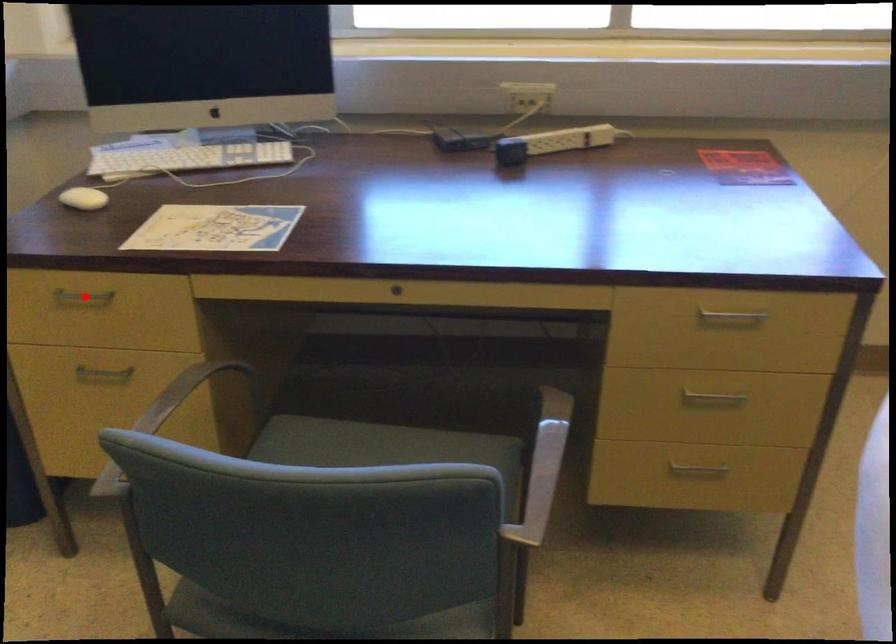
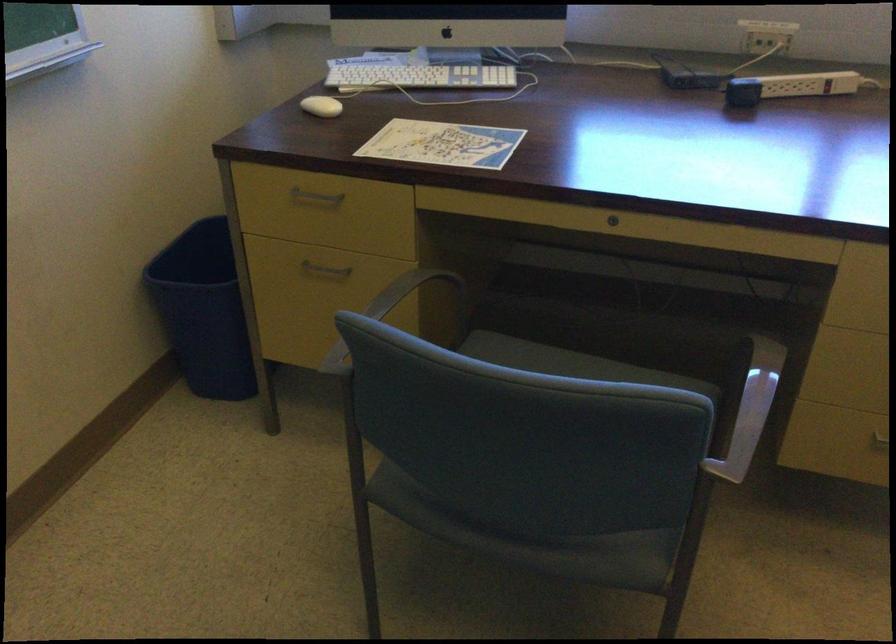
Locate, in the second image, the point that corresponds to the highlighted location in the first image.

(315, 196)